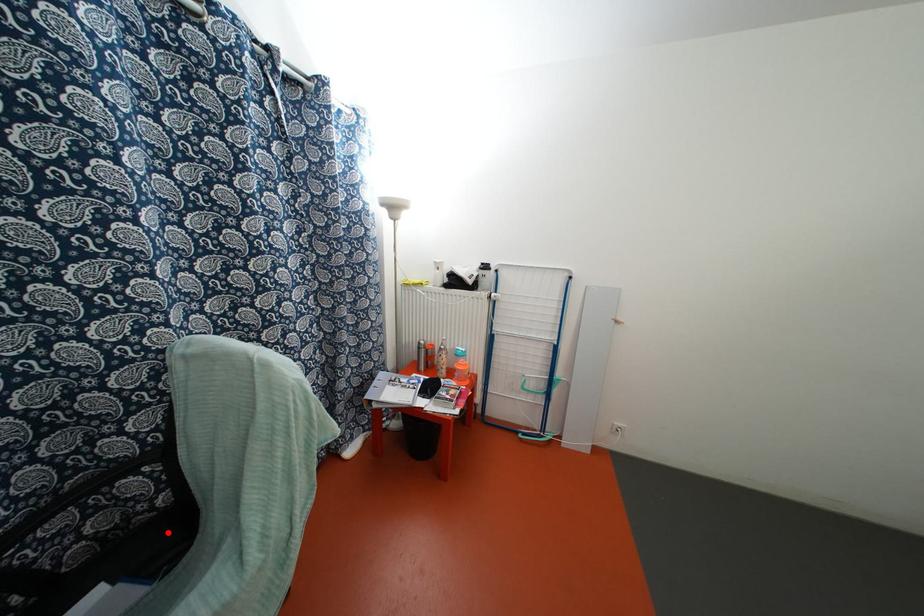
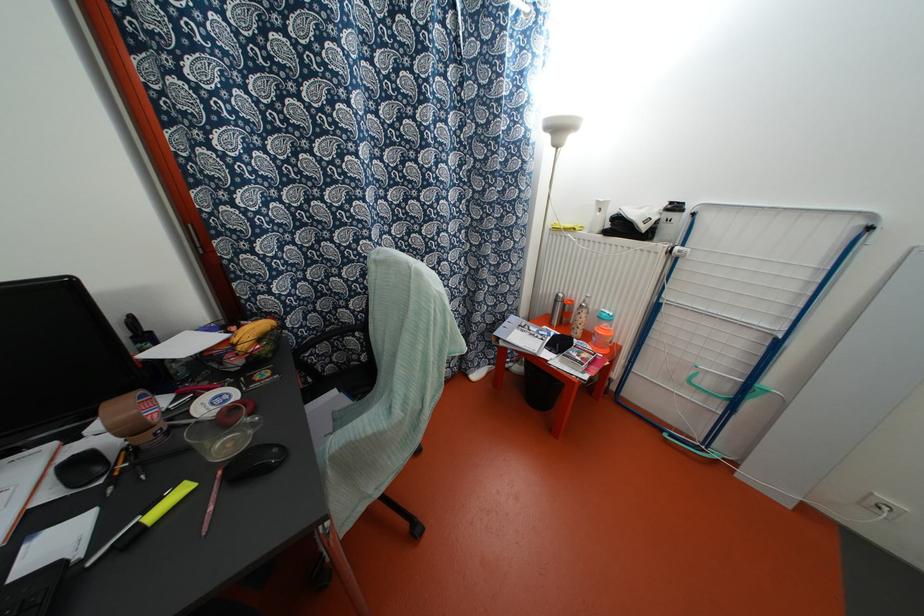
Locate, in the second image, the point that corresponds to the highlighted location in the first image.

(362, 377)